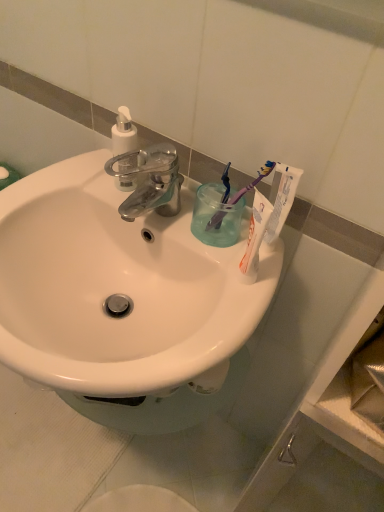
Question: Can you confirm if transparent plastic cup at upper right is taller than white glossy sink at center?

Choices:
 (A) no
 (B) yes

Answer: (A)

Question: From a real-world perspective, is transparent plastic cup at upper right over white glossy sink at center?

Choices:
 (A) yes
 (B) no

Answer: (A)

Question: Is transparent plastic cup at upper right shorter than white glossy sink at center?

Choices:
 (A) no
 (B) yes

Answer: (B)

Question: From the image's perspective, is transparent plastic cup at upper right above white glossy sink at center?

Choices:
 (A) yes
 (B) no

Answer: (A)

Question: Can you confirm if transparent plastic cup at upper right is positioned to the right of white glossy sink at center?

Choices:
 (A) yes
 (B) no

Answer: (A)

Question: Considering the relative positions of transparent plastic cup at upper right and white glossy sink at center in the image provided, is transparent plastic cup at upper right in front of white glossy sink at center?

Choices:
 (A) no
 (B) yes

Answer: (A)

Question: Is purple plastic toothbrush at upper right, which is the first toothbrush from right to left, facing away from blue plastic toothbrush at upper right, the second toothbrush positioned from the right?

Choices:
 (A) no
 (B) yes

Answer: (A)

Question: Is purple plastic toothbrush at upper right, which is the first toothbrush from right to left, smaller than blue plastic toothbrush at upper right, the first toothbrush when ordered from left to right?

Choices:
 (A) no
 (B) yes

Answer: (A)

Question: From a real-world perspective, is purple plastic toothbrush at upper right, which is the first toothbrush from right to left, positioned over blue plastic toothbrush at upper right, the first toothbrush when ordered from left to right, based on gravity?

Choices:
 (A) no
 (B) yes

Answer: (B)

Question: Is purple plastic toothbrush at upper right, which is the second toothbrush in left-to-right order, positioned beyond the bounds of blue plastic toothbrush at upper right, the first toothbrush when ordered from left to right?

Choices:
 (A) no
 (B) yes

Answer: (B)

Question: From the image's perspective, does purple plastic toothbrush at upper right, which is the second toothbrush in left-to-right order, appear lower than blue plastic toothbrush at upper right, the first toothbrush when ordered from left to right?

Choices:
 (A) no
 (B) yes

Answer: (B)

Question: Is purple plastic toothbrush at upper right, which is the second toothbrush in left-to-right order, at the right side of blue plastic toothbrush at upper right, the second toothbrush positioned from the right?

Choices:
 (A) no
 (B) yes

Answer: (B)

Question: Is blue plastic toothbrush at upper right, the first toothbrush when ordered from left to right, beside white plastic soap dispenser at upper left?

Choices:
 (A) yes
 (B) no

Answer: (B)